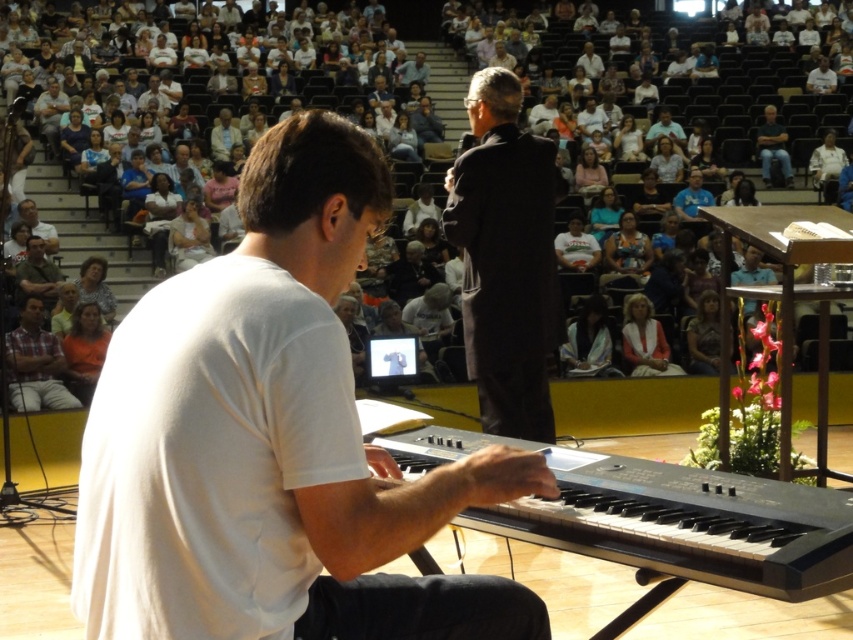
Is the position of matte khaki shirt at lower left more distant than that of white cotton shirt at upper center?

No, it is not.

Who is higher up, matte khaki shirt at lower left or white cotton shirt at upper center?

white cotton shirt at upper center

Does point (56, 296) come in front of point (215, 152)?

Yes, point (56, 296) is closer to viewer.

You are a GUI agent. You are given a task and a screenshot of the screen. Output one action in this format:
    pyautogui.click(x=<x>, y=<y>)
    Task: Click on the matte khaki shirt at lower left
    This screenshot has width=853, height=640.
    Given the screenshot: What is the action you would take?
    pyautogui.click(x=38, y=273)

Is point (352, 157) more distant than point (426, 444)?

No, it is in front of (426, 444).

Who is taller, white matte keyboard at center or black plastic keyboard at center?

With more height is white matte keyboard at center.

The height and width of the screenshot is (640, 853). What are the coordinates of `white matte keyboard at center` in the screenshot? It's located at (273, 440).

The height and width of the screenshot is (640, 853). Identify the location of white matte keyboard at center. (273, 440).

Is point (537, 204) farther from viewer compared to point (54, 400)?

No, (537, 204) is in front of (54, 400).

Locate an element on the screen. dark suit at center is located at coordinates (505, 259).